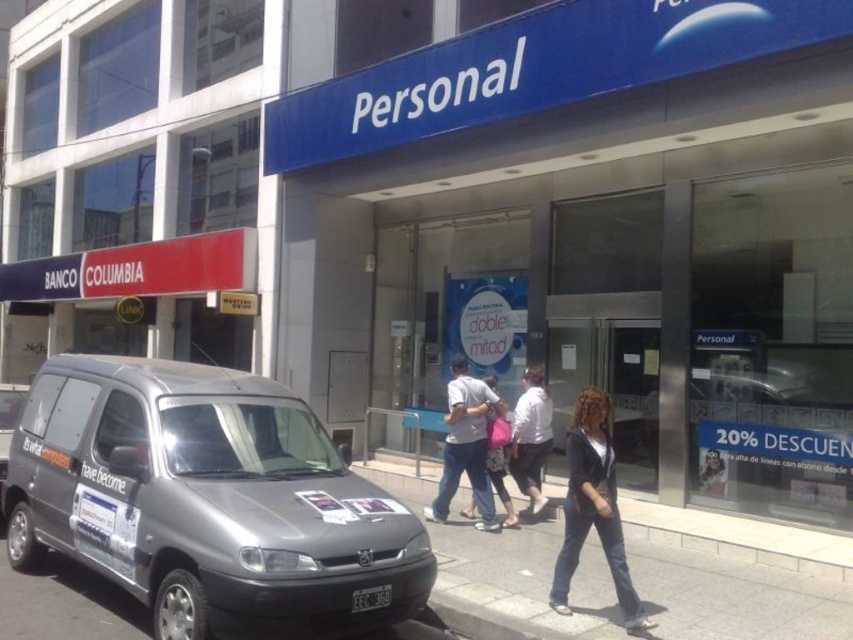
Between blue plastic sign at upper center and pink fabric bag at center, which one appears on the left side from the viewer's perspective?

From the viewer's perspective, pink fabric bag at center appears more on the left side.

Which is in front, point (619, 332) or point (488, 412)?

Point (488, 412)

Between point (488, 216) and point (508, 451), which one is positioned in front?

Point (508, 451)

What are the coordinates of `blue plastic sign at upper center` in the screenshot? It's located at (602, 227).

Is the position of light gray concrete sidewalk at center more distant than that of pink fabric bag at center?

No, it is in front of pink fabric bag at center.

The width and height of the screenshot is (853, 640). I want to click on light gray concrete sidewalk at center, so click(734, 592).

Locate an element on the screen. light gray concrete sidewalk at center is located at coordinates (734, 592).

Who is higher up, blue plastic sign at upper center or denim jeans at lower right?

blue plastic sign at upper center

Is the position of blue plastic sign at upper center less distant than that of denim jeans at lower right?

No, it is not.

Does point (503, 68) come in front of point (579, 403)?

No, (503, 68) is further to viewer.

At what (x,y) coordinates should I click in order to perform the action: click on blue plastic sign at upper center. Please return your answer as a coordinate pair (x, y). Looking at the image, I should click on (602, 227).